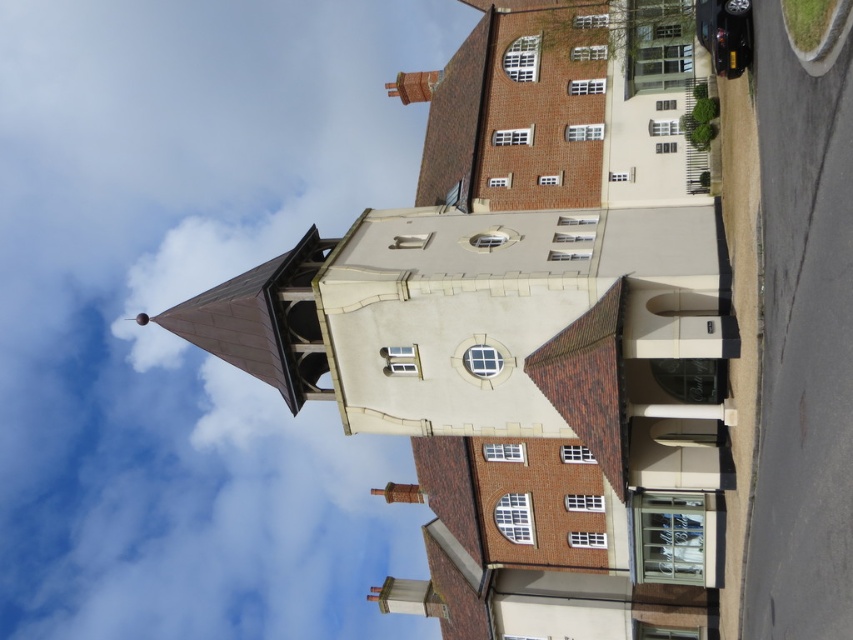
You are an architect analyzing the building design. You need to determine which object occupies more space in the image between the brown tiled tower at center and the metallic silver clock at center. Based on the provided scene description, which one is larger?

The brown tiled tower at center has a larger size compared to the metallic silver clock at center, so the brown tiled tower at center occupies more space in the image.

Based on the photo, you are a maintenance worker needing to replace a part located on the brown tiled tower at center. You have a ladder that is 20 meters long. Can you safely reach the metallic silver clock at center while working on the tower?

The distance between the brown tiled tower at center and the metallic silver clock at center is 21.76 meters. Since the ladder is only 20 meters long, it is not long enough to safely reach the metallic silver clock at center from the brown tiled tower at center.

You are an architect analyzing the building structure. You need to determine which object occupies more horizontal space in the image between the brown tiled tower at center and the metallic silver clock at center. Which one is wider?

The brown tiled tower at center is wider than the metallic silver clock at center according to the description provided.